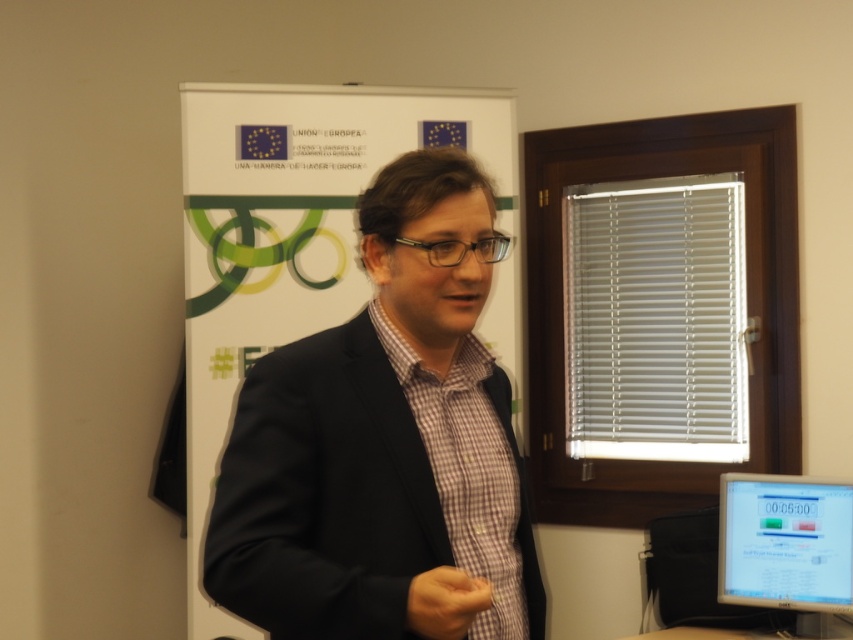
Can you confirm if white paperboard at center is positioned below brown leather hand at center?

No, white paperboard at center is not below brown leather hand at center.

This screenshot has width=853, height=640. What do you see at coordinates (294, 202) in the screenshot?
I see `white paperboard at center` at bounding box center [294, 202].

Locate an element on the screen. The width and height of the screenshot is (853, 640). white paperboard at center is located at coordinates (294, 202).

Consider the image. Can you confirm if matte black monitor at lower right is thinner than brown leather hand at center?

Incorrect, matte black monitor at lower right's width is not less than brown leather hand at center's.

Who is positioned more to the right, matte black monitor at lower right or brown leather hand at center?

From the viewer's perspective, matte black monitor at lower right appears more on the right side.

Is point (802, 518) positioned behind point (473, 616)?

Yes, it is.

This screenshot has width=853, height=640. Identify the location of matte black monitor at lower right. (785, 541).

Does white paperboard at center have a greater height compared to matte black monitor at lower right?

Yes.

Who is higher up, white paperboard at center or matte black monitor at lower right?

Positioned higher is white paperboard at center.

Does point (209, 401) come farther from viewer compared to point (737, 500)?

Yes, it is.

I want to click on white paperboard at center, so click(x=294, y=202).